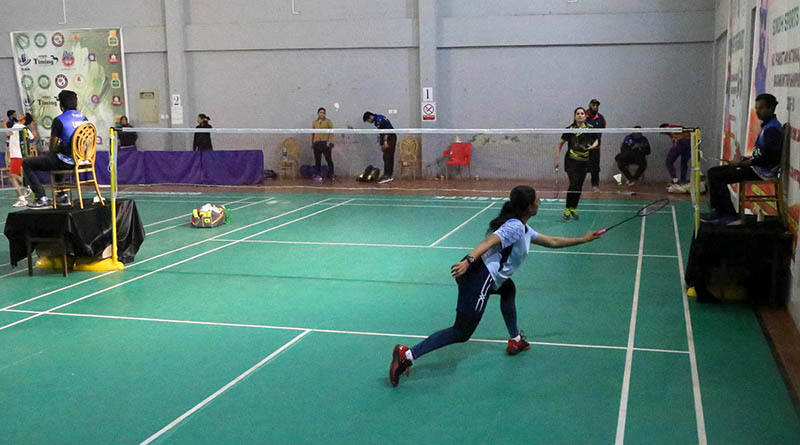
The width and height of the screenshot is (800, 445). What are the coordinates of `wooden chair` in the screenshot? It's located at (405, 154), (286, 156), (89, 154), (774, 191).